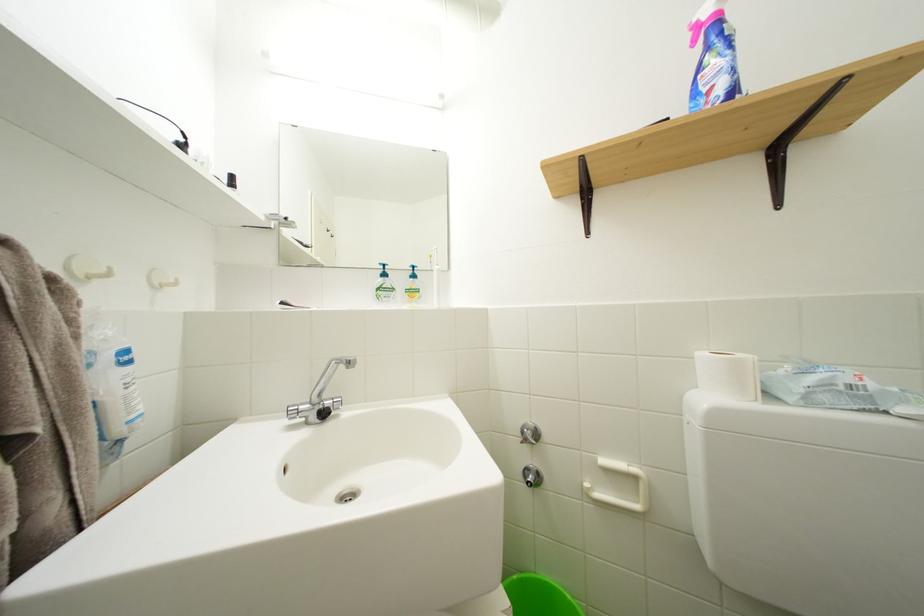
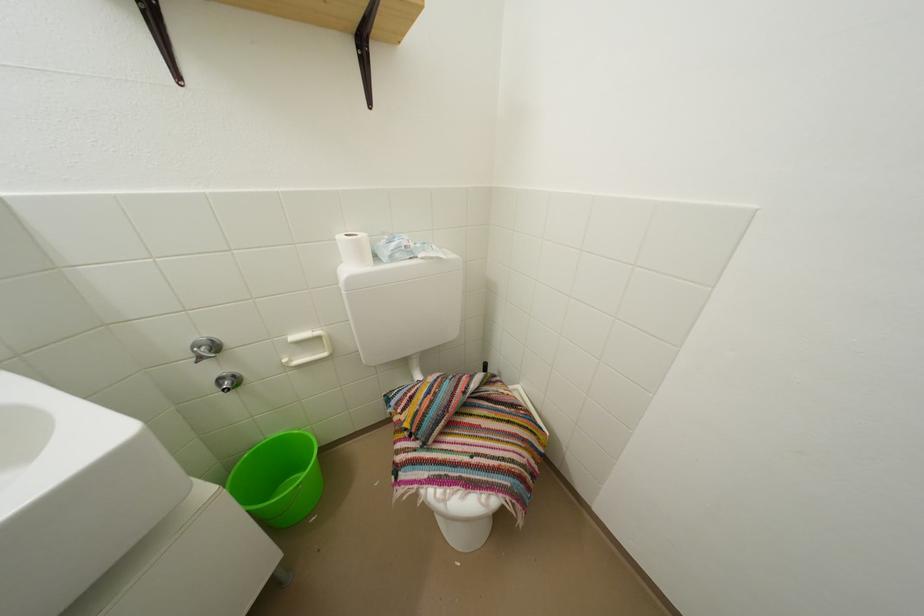
Find the pixel in the second image that matches point 536,476 in the first image.

(229, 386)